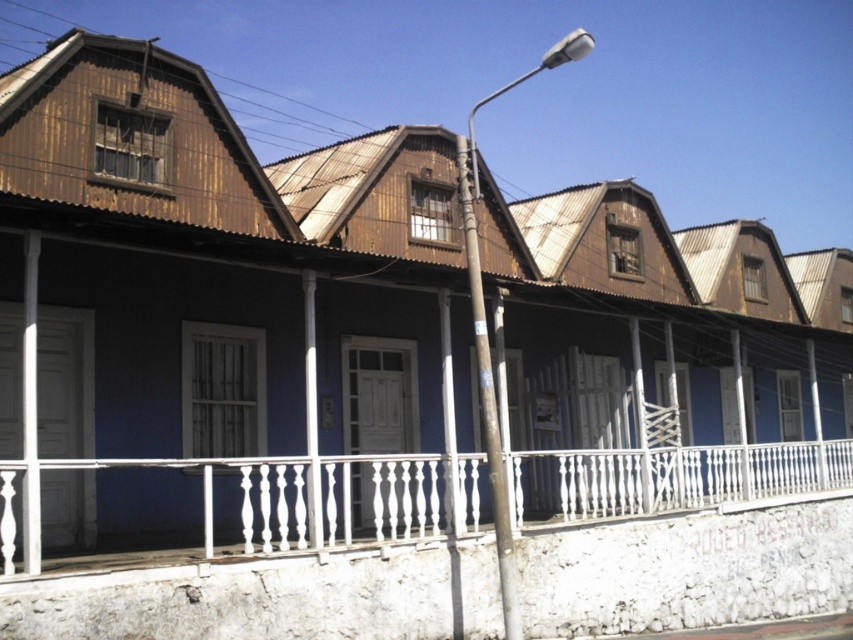
Question: Which object is closer to the camera taking this photo?

Choices:
 (A) white painted wood balustrade at center
 (B) smooth gray pole at center

Answer: (A)

Question: Which point appears closest to the camera in this image?

Choices:
 (A) (32, 564)
 (B) (479, 388)

Answer: (A)

Question: Is white painted wood balustrade at center further to the viewer compared to smooth gray pole at center?

Choices:
 (A) no
 (B) yes

Answer: (A)

Question: Is white painted wood balustrade at center positioned behind smooth gray pole at center?

Choices:
 (A) no
 (B) yes

Answer: (A)

Question: Where is white painted wood balustrade at center located in relation to smooth gray pole at center in the image?

Choices:
 (A) above
 (B) below

Answer: (B)